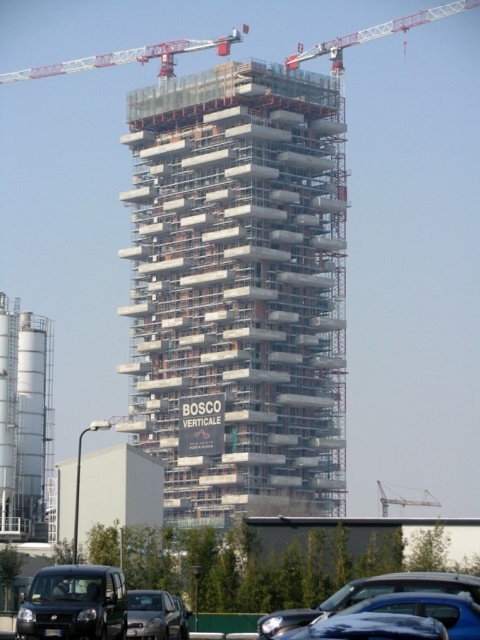
You are a construction worker who needs to move a heavy equipment from the parking area to the construction site. The equipment is too large to fit through any door. You have to decide whether to place it next to the concrete scaffolding at center or the metallic gray crane at center. Which one should you choose based on their sizes?

The concrete scaffolding at center is bigger than the metallic gray crane at center, so you should place the heavy equipment next to the concrete scaffolding at center since it has more space available.

You are standing at the construction site of BOSCO VERTICALE and need to reach the parking area. The matte black van at lower left is your vehicle. Considering the distance between you and the van, can you walk there in 2 minutes if your walking speed is 1.4 meters per second?

The distance between you and the matte black van at lower left is 58.70 meters. At a walking speed of 1.4 meters per second, it would take approximately 41.9 seconds, which is less than 2 minutes. Therefore, you can reach the matte black van at lower left in under 2 minutes.